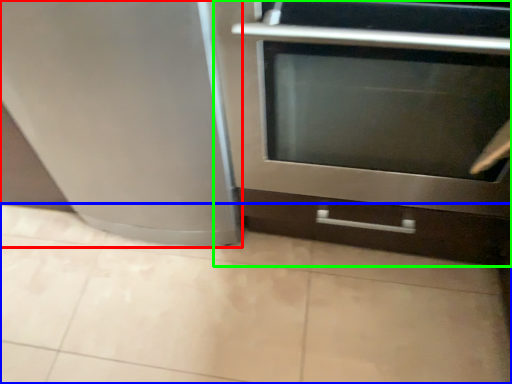
Question: Estimate the real-world distances between objects in this image. Which object is farther from appliance (highlighted by a red box), ceramic tile (highlighted by a blue box) or oven (highlighted by a green box)?

Choices:
 (A) ceramic tile
 (B) oven

Answer: (A)